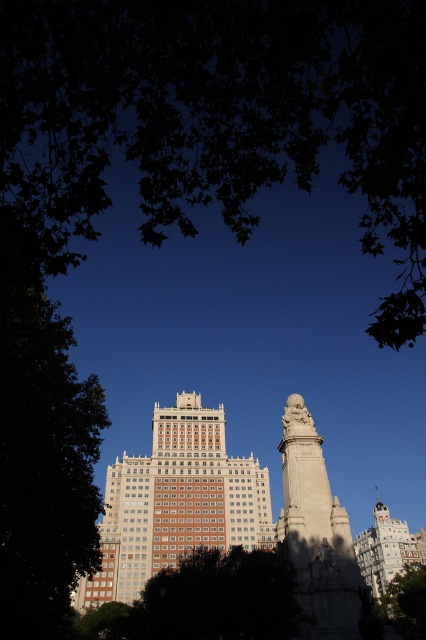
Question: Among these points, which one is farthest from the camera?

Choices:
 (A) (180, 76)
 (B) (40, 388)

Answer: (B)

Question: Can you confirm if green leafy tree at upper left is positioned to the left of green leafy tree at lower left?

Choices:
 (A) no
 (B) yes

Answer: (A)

Question: Can you confirm if green leafy tree at left is bigger than white marble statue at center?

Choices:
 (A) yes
 (B) no

Answer: (A)

Question: Which object is positioned closest to the white brick building at center?

Choices:
 (A) white stone tower at center
 (B) white stone monument at center
 (C) green leafy tree at upper left
 (D) dark green leafy tree at lower center

Answer: (D)

Question: In this image, where is green leafy tree at upper left located relative to white brick building at center?

Choices:
 (A) right
 (B) left

Answer: (A)

Question: Estimate the real-world distances between objects in this image. Which object is farther from the green leafy tree at left?

Choices:
 (A) white stone monument at center
 (B) white brick building at center

Answer: (A)